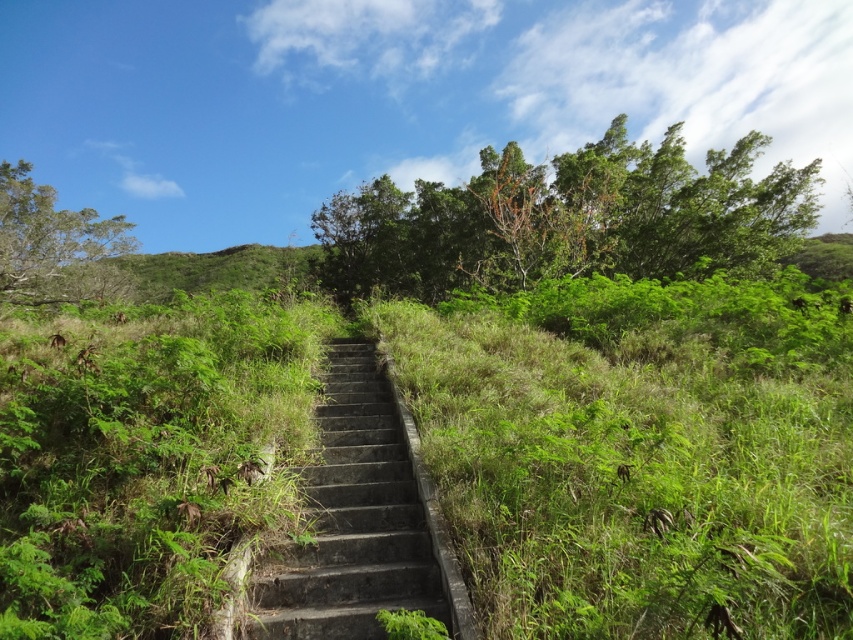
You are standing at the base of the stone stairs and want to take a photo of the green grassy area at center. If your camera has a focal length of 50mm, which is suitable for capturing landscapes, will you need to move closer or farther away to ensure the green grassy at center fills the frame properly?

The green grassy at center and camera are 9.76 feet apart. With a 50mm focal length, which is considered standard and captures a natural field of view, you would likely need to move slightly closer to ensure the green grassy at center fills the frame properly, as 9.76 feet might be a bit too far for optimal composition.

You are standing at the bottom of the stone stairs and want to walk towards the green leafy bush at upper center. Which direction should you move relative to the green grassy at center?

You should move to the right relative to the green grassy at center because the green leafy bush at upper center is located to the right of the green grassy at center.